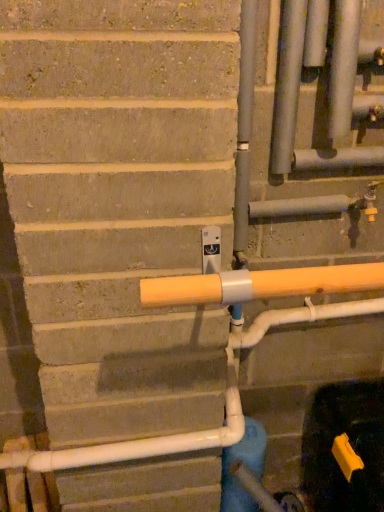
Question: Is satin silver pipes at upper right, placed as the 1th pipe when sorted from left to right, thinner than matte silver pipe at upper right, the 2th pipe when ordered from left to right?

Choices:
 (A) yes
 (B) no

Answer: (A)

Question: Is satin silver pipes at upper right, placed as the 1th pipe when sorted from left to right, in front of matte silver pipe at upper right, arranged as the 1th pipe when viewed from the right?

Choices:
 (A) yes
 (B) no

Answer: (B)

Question: From the image's perspective, is satin silver pipes at upper right, placed as the 1th pipe when sorted from left to right, below matte silver pipe at upper right, arranged as the 1th pipe when viewed from the right?

Choices:
 (A) yes
 (B) no

Answer: (A)

Question: From a real-world perspective, is satin silver pipes at upper right, marked as the second pipe in a right-to-left arrangement, over matte silver pipe at upper right, the 2th pipe when ordered from left to right?

Choices:
 (A) no
 (B) yes

Answer: (A)

Question: Is satin silver pipes at upper right, marked as the second pipe in a right-to-left arrangement, outside of matte silver pipe at upper right, arranged as the 1th pipe when viewed from the right?

Choices:
 (A) yes
 (B) no

Answer: (A)

Question: Does satin silver pipes at upper right, marked as the second pipe in a right-to-left arrangement, have a larger size compared to matte silver pipe at upper right, arranged as the 1th pipe when viewed from the right?

Choices:
 (A) no
 (B) yes

Answer: (A)

Question: Can we say matte silver pipe at upper right, arranged as the 1th pipe when viewed from the right, lies outside satin silver pipes at upper right, marked as the second pipe in a right-to-left arrangement?

Choices:
 (A) yes
 (B) no

Answer: (A)

Question: From a real-world perspective, does matte silver pipe at upper right, arranged as the 1th pipe when viewed from the right, sit lower than satin silver pipes at upper right, placed as the 1th pipe when sorted from left to right?

Choices:
 (A) yes
 (B) no

Answer: (B)

Question: Does matte silver pipe at upper right, arranged as the 1th pipe when viewed from the right, have a greater width compared to satin silver pipes at upper right, placed as the 1th pipe when sorted from left to right?

Choices:
 (A) no
 (B) yes

Answer: (B)

Question: From a real-world perspective, is matte silver pipe at upper right, the 2th pipe when ordered from left to right, physically above satin silver pipes at upper right, placed as the 1th pipe when sorted from left to right?

Choices:
 (A) yes
 (B) no

Answer: (A)

Question: Is matte silver pipe at upper right, the 2th pipe when ordered from left to right, shorter than satin silver pipes at upper right, placed as the 1th pipe when sorted from left to right?

Choices:
 (A) no
 (B) yes

Answer: (A)

Question: Is satin silver pipes at upper right, placed as the 1th pipe when sorted from left to right, at the back of matte silver pipe at upper right, the 2th pipe when ordered from left to right?

Choices:
 (A) yes
 (B) no

Answer: (B)

Question: Considering the relative sizes of blue matte water pipe at lower center and matte silver pipe at upper right, the 2th pipe when ordered from left to right, in the image provided, is blue matte water pipe at lower center smaller than matte silver pipe at upper right, the 2th pipe when ordered from left to right,?

Choices:
 (A) no
 (B) yes

Answer: (A)